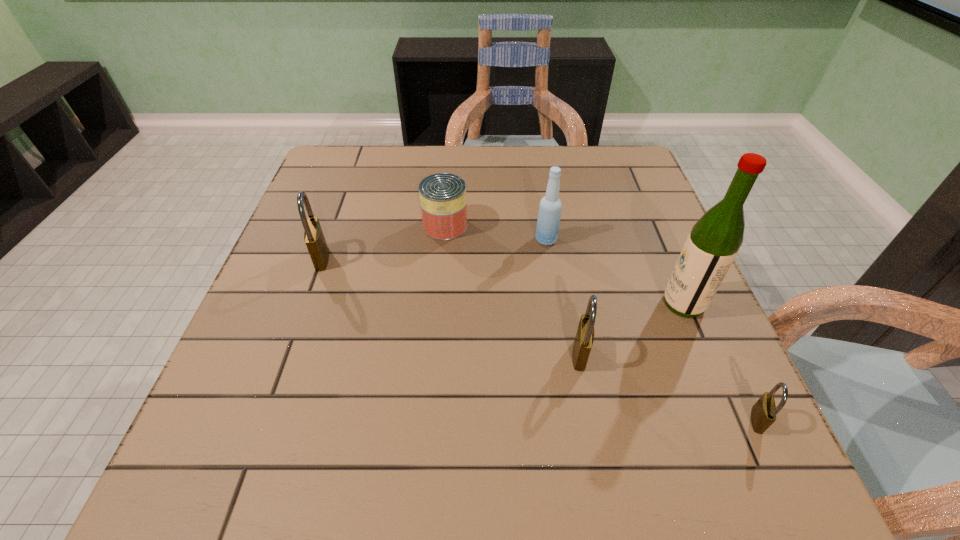
Where is `padlock at the right edge`? This screenshot has height=540, width=960. padlock at the right edge is located at coordinates (763, 414).

The height and width of the screenshot is (540, 960). Find the location of `liquor positioned at the right edge`. liquor positioned at the right edge is located at coordinates (714, 241).

This screenshot has height=540, width=960. Find the location of `object that is at the near right corner`. object that is at the near right corner is located at coordinates (763, 414).

In the image, there is a desktop. Identify the location of vacant space at the far edge. The height and width of the screenshot is (540, 960). (574, 158).

In the image, there is a desktop. What are the coordinates of `vacant area at the near edge` in the screenshot? It's located at (477, 384).

Identify the location of free space at the left edge. (347, 270).

Image resolution: width=960 pixels, height=540 pixels. In the image, there is a desktop. What are the coordinates of `free region at the right edge` in the screenshot? It's located at (661, 211).

The image size is (960, 540). In the image, there is a desktop. Identify the location of vacant space at the far left corner. (351, 157).

Find the location of a particular element. The image size is (960, 540). vacant space at the near left corner of the desktop is located at coordinates (266, 427).

Identify the location of empty space between the third nearest object and the nearest padlock. (720, 362).